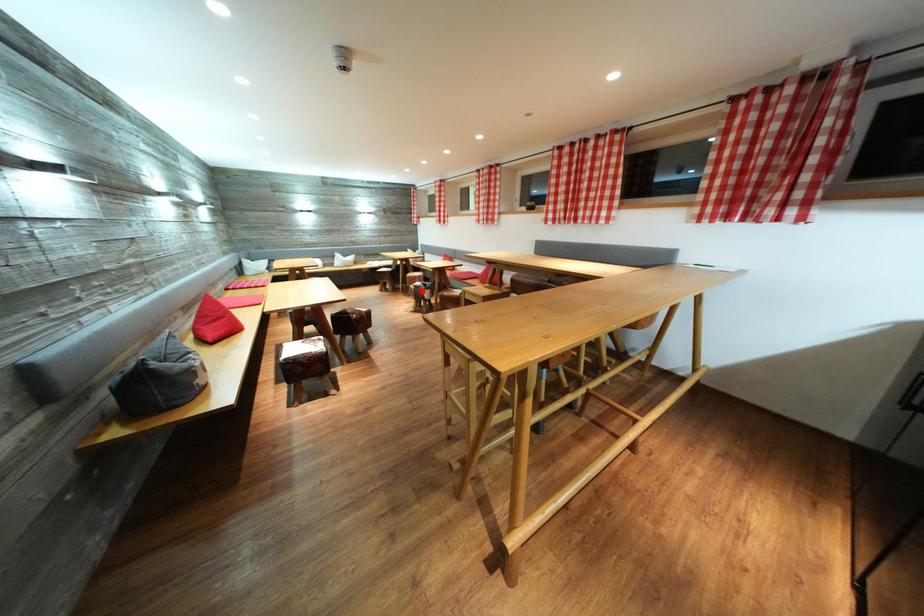
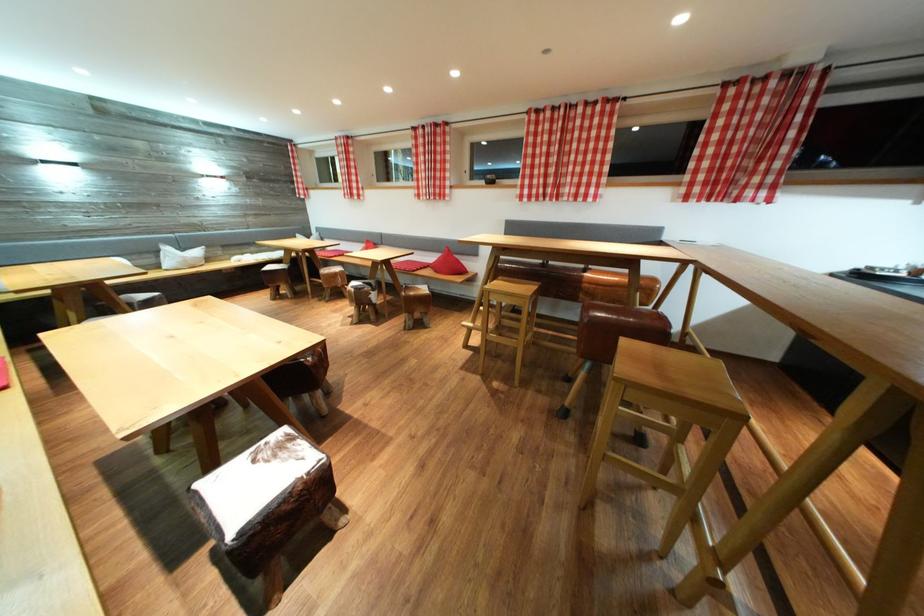
Locate, in the second image, the point that corresponds to the highlighted location in the first image.

(362, 294)